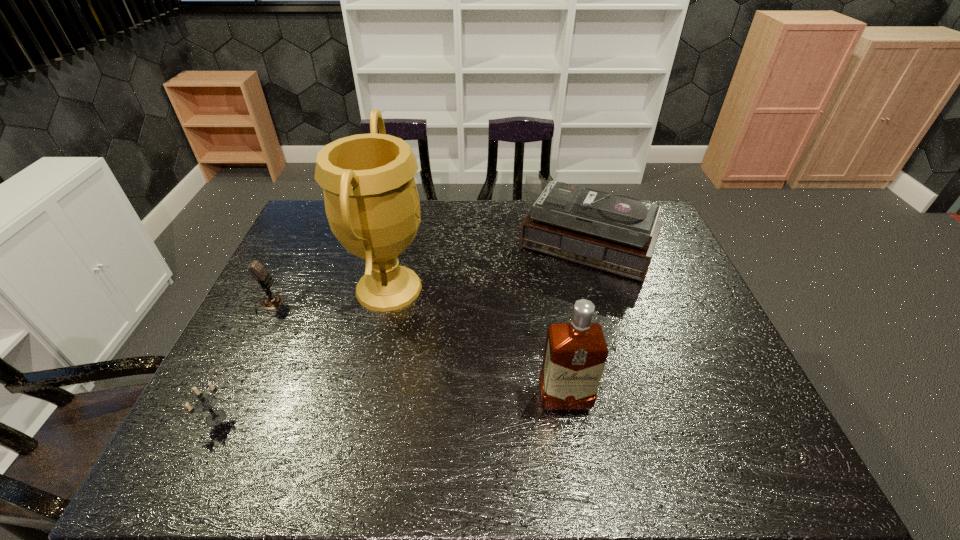
Find the location of a particular element. The height and width of the screenshot is (540, 960). vacant region between the microphone and the candle holder is located at coordinates tap(242, 361).

Choose which object is the second nearest neighbor to the third object from right to left. Please provide its 2D coordinates. Your answer should be formatted as a tuple, i.e. [(x, y)], where the tuple contains the x and y coordinates of a point satisfying the conditions above.

[(204, 403)]

In order to click on object that stands as the closest to the liquor in this screenshot , I will do `click(616, 233)`.

Image resolution: width=960 pixels, height=540 pixels. Find the location of `vacant space that satisfies the following two spatial constraints: 1. on the front-facing side of the second shortest object; 2. on the right side of the candle holder`. vacant space that satisfies the following two spatial constraints: 1. on the front-facing side of the second shortest object; 2. on the right side of the candle holder is located at coordinates (212, 418).

Image resolution: width=960 pixels, height=540 pixels. Find the location of `blank area in the image that satisfies the following two spatial constraints: 1. on the front-facing side of the shortest object; 2. on the right side of the microphone`. blank area in the image that satisfies the following two spatial constraints: 1. on the front-facing side of the shortest object; 2. on the right side of the microphone is located at coordinates (212, 418).

Locate an element on the screen. The image size is (960, 540). vacant space that satisfies the following two spatial constraints: 1. on the engravings side of the tallest object; 2. on the front side of the shortest object is located at coordinates (360, 418).

At what (x,y) coordinates should I click in order to perform the action: click on vacant space that satisfies the following two spatial constraints: 1. on the front side of the record player; 2. on the front-facing side of the fourth tallest object. Please return your answer as a coordinate pair (x, y). The height and width of the screenshot is (540, 960). Looking at the image, I should click on (601, 304).

The image size is (960, 540). In order to click on vacant space that satisfies the following two spatial constraints: 1. on the front side of the record player; 2. on the front-facing side of the microphone in this screenshot , I will do `click(601, 304)`.